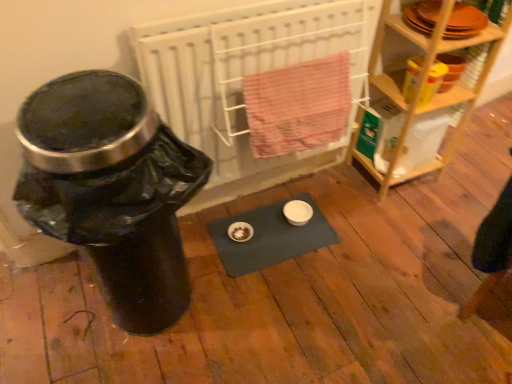
In order to click on vacant space that is in between blue fabric yoga mat at center and black plastic water cooler at left in this screenshot , I will do `click(248, 266)`.